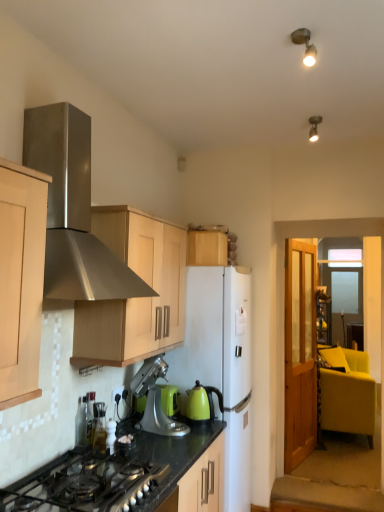
Image resolution: width=384 pixels, height=512 pixels. In order to click on vacant point to the right of clear glass bottle at center, acting as the first appliance starting from the front in this screenshot , I will do `click(137, 450)`.